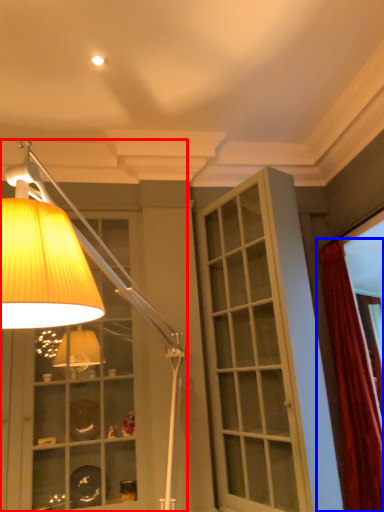
Question: Which of the following is the farthest to the observer, lamp (highlighted by a red box) or curtain (highlighted by a blue box)?

Choices:
 (A) lamp
 (B) curtain

Answer: (B)